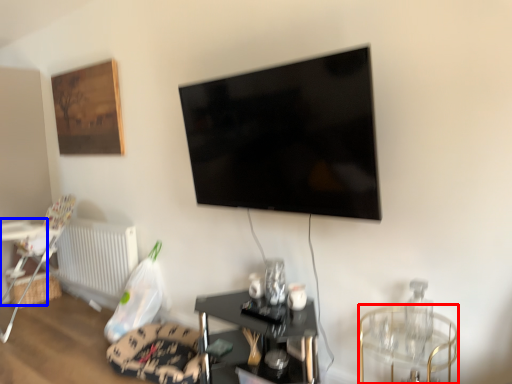
Question: Which object is further to the camera taking this photo, glass table (highlighted by a red box) or table (highlighted by a blue box)?

Choices:
 (A) glass table
 (B) table

Answer: (B)